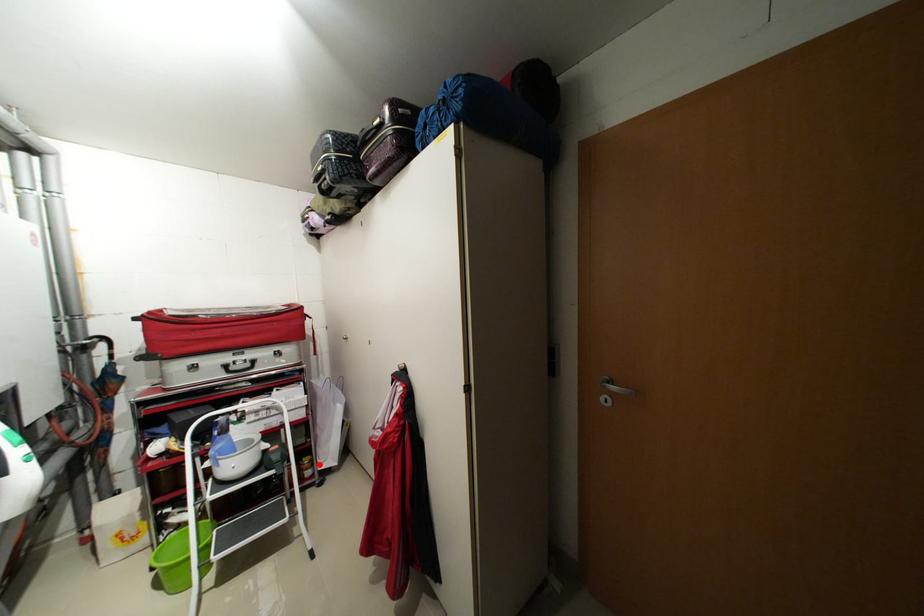
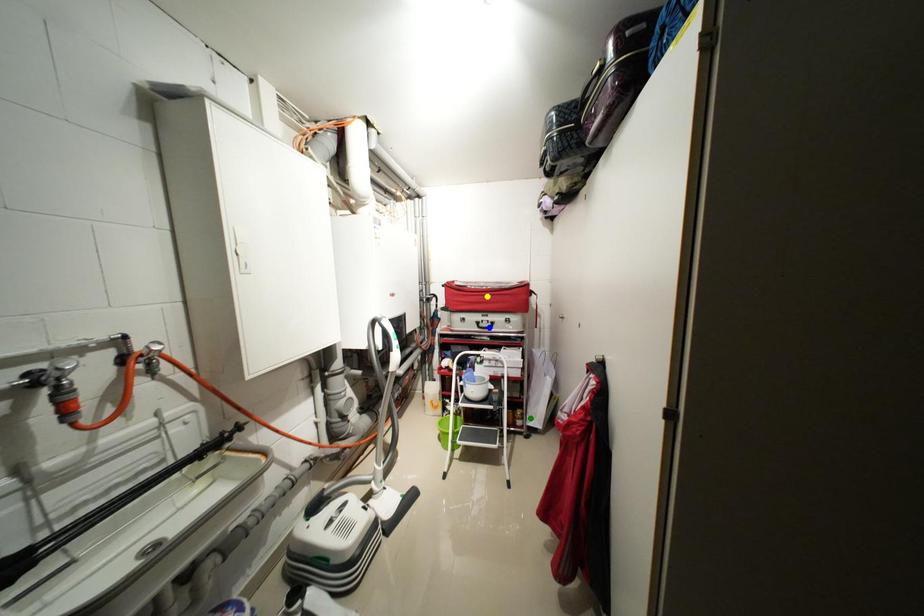
Question: I am providing you with two images of the same scene from different viewpoints. A red point is marked on the first image. You are given multiple points on the second image. Which mark in image 2 goes with the point in image 1?

Choices:
 (A) green point
 (B) blue point
 (C) yellow point

Answer: (A)